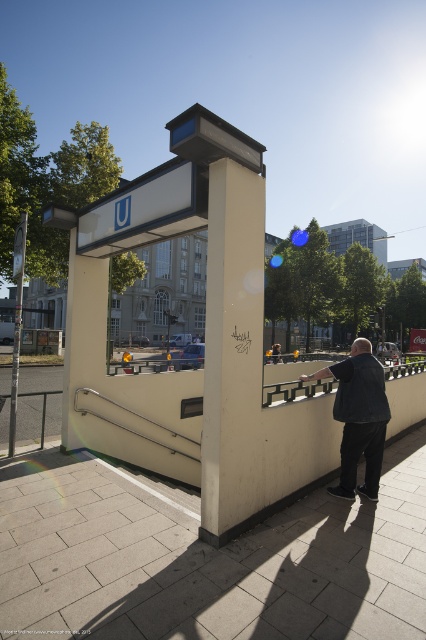
Question: Does gray concrete pavement at lower center have a lesser width compared to dark blue denim jacket at center?

Choices:
 (A) no
 (B) yes

Answer: (A)

Question: Is gray concrete pavement at lower center above beige concrete bus stop at center?

Choices:
 (A) no
 (B) yes

Answer: (A)

Question: Which object is the closest to the dark blue denim jacket at center?

Choices:
 (A) beige concrete bus stop at center
 (B) gray concrete pavement at lower center

Answer: (A)

Question: Which point is farther from the camera taking this photo?

Choices:
 (A) (80, 310)
 (B) (350, 428)

Answer: (A)

Question: Does gray concrete pavement at lower center appear over beige concrete bus stop at center?

Choices:
 (A) yes
 (B) no

Answer: (B)

Question: Among these points, which one is farthest from the camera?

Choices:
 (A) (256, 632)
 (B) (256, 349)
 (C) (370, 385)

Answer: (C)